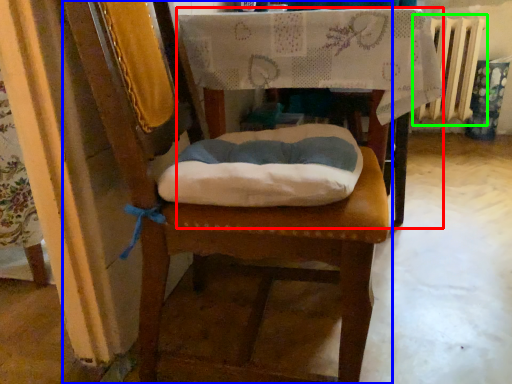
Question: Which object is the closest to the table (highlighted by a red box)? Choose among these: chair (highlighted by a blue box) or radiator (highlighted by a green box).

Choices:
 (A) chair
 (B) radiator

Answer: (A)